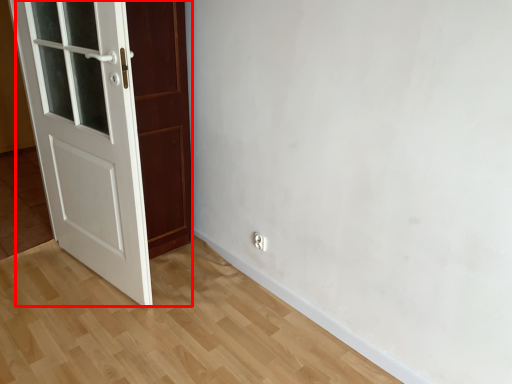
Question: Observing the image, what is the correct spatial positioning of door (annotated by the red box) in reference to electric outlet?

Choices:
 (A) left
 (B) right

Answer: (A)